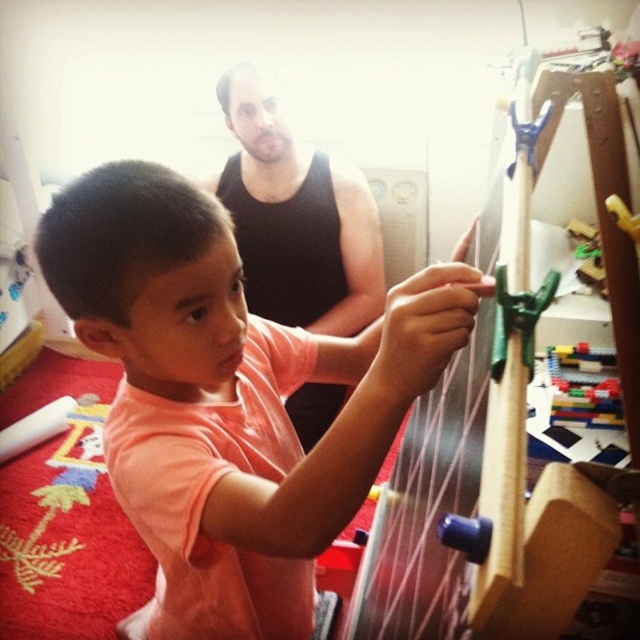
Is point (38, 228) closer to viewer compared to point (579, 342)?

That is True.

Consider the image. Is pink matte shirt at center further to the viewer compared to translucent plastic blocks at upper right?

No, pink matte shirt at center is in front of translucent plastic blocks at upper right.

Is point (285, 371) positioned after point (618, 406)?

No, it is not.

Locate an element on the screen. This screenshot has width=640, height=640. pink matte shirt at center is located at coordinates (230, 397).

In the scene shown: Between pink matte shirt at center and black tank top at upper center, which one has less height?

With less height is pink matte shirt at center.

Who is more distant from viewer, (x=387, y=442) or (x=296, y=276)?

The point (x=296, y=276) is more distant.

Is point (250, 387) in front of point (282, 260)?

Yes, it is.

I want to click on pink matte shirt at center, so click(x=230, y=397).

You are a GUI agent. You are given a task and a screenshot of the screen. Output one action in this format:
    pyautogui.click(x=<x>, y=<y>)
    Task: Click on the black tank top at upper center
    This screenshot has width=640, height=640.
    Given the screenshot: What is the action you would take?
    pyautogui.click(x=296, y=220)

Can you confirm if black tank top at upper center is positioned to the left of translucent plastic blocks at upper right?

Yes, black tank top at upper center is to the left of translucent plastic blocks at upper right.

Identify the location of black tank top at upper center. The height and width of the screenshot is (640, 640). (296, 220).

You are a GUI agent. You are given a task and a screenshot of the screen. Output one action in this format:
    pyautogui.click(x=<x>, y=<y>)
    Task: Click on the black tank top at upper center
    
    Given the screenshot: What is the action you would take?
    pyautogui.click(x=296, y=220)